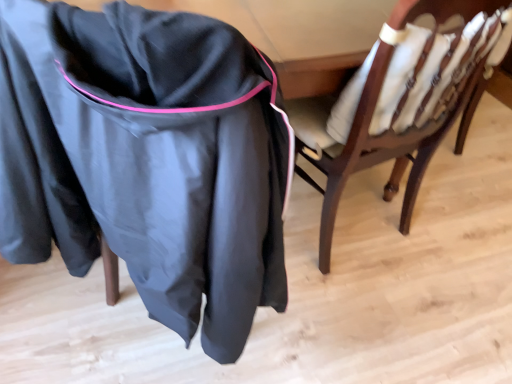
Locate an element on the screen. The height and width of the screenshot is (384, 512). vacant area that is in front of wooden chair with white cushions at center is located at coordinates (374, 322).